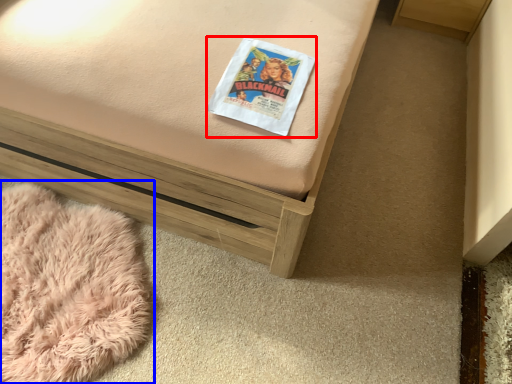
Question: Which object is closer to the camera taking this photo, paperback book (highlighted by a red box) or blanket (highlighted by a blue box)?

Choices:
 (A) paperback book
 (B) blanket

Answer: (A)